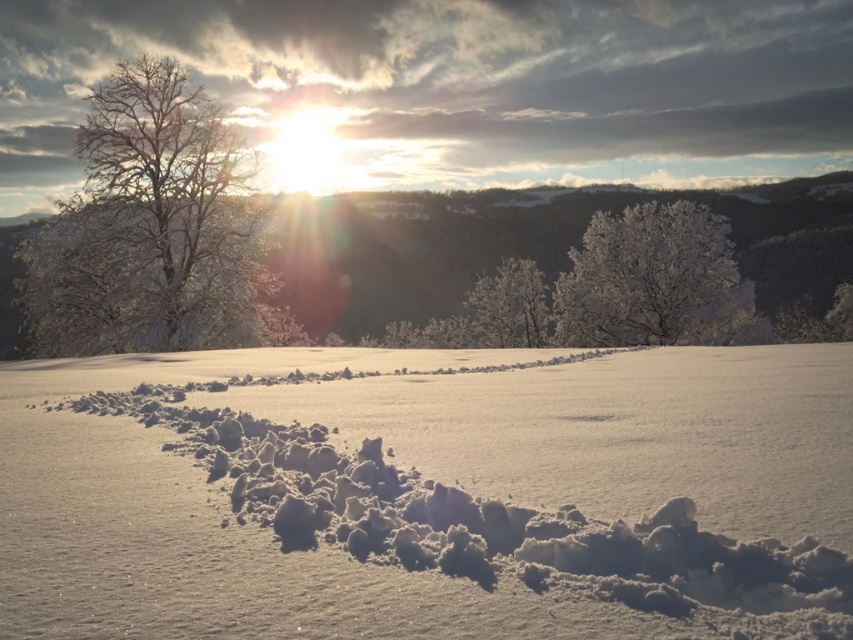
You are standing at the starting point of the snow trail and want to reach the distant tree located at point (654,260). However, there is an obstacle at point (192,160). Can you walk around it without stepping off the snow? Explain your reasoning based on their positions.

Point (192,160) is in front of point (654,260), so the obstacle at point (192,160) is closer to you. Since you are on the snow trail, you can walk around the obstacle by stepping slightly to the side while staying on the snow, as the snow is otherwise undisturbed except for the trail. However, the trail itself leads directly towards the distant tree, so deviating might require stepping off the snow temporarily.